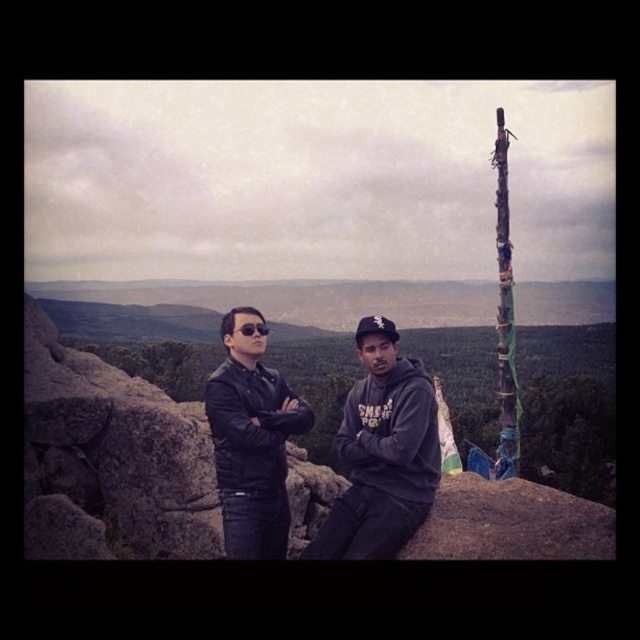
You are a photographer wanting to capture both the dark gray hoodie at center and the leather jacket at center in the same frame. Your camera has a focal length of 50mm. Knowing that a 50mm lens has a field of view that can cover about 4.5 meters at this distance, can both subjects be in the frame without moving?

The distance between the dark gray hoodie at center and the leather jacket at center is 2.38 meters. Since the field of view covers 4.5 meters, which is wider than the 2.38 meters separating them, both subjects can fit within the frame without needing to move.